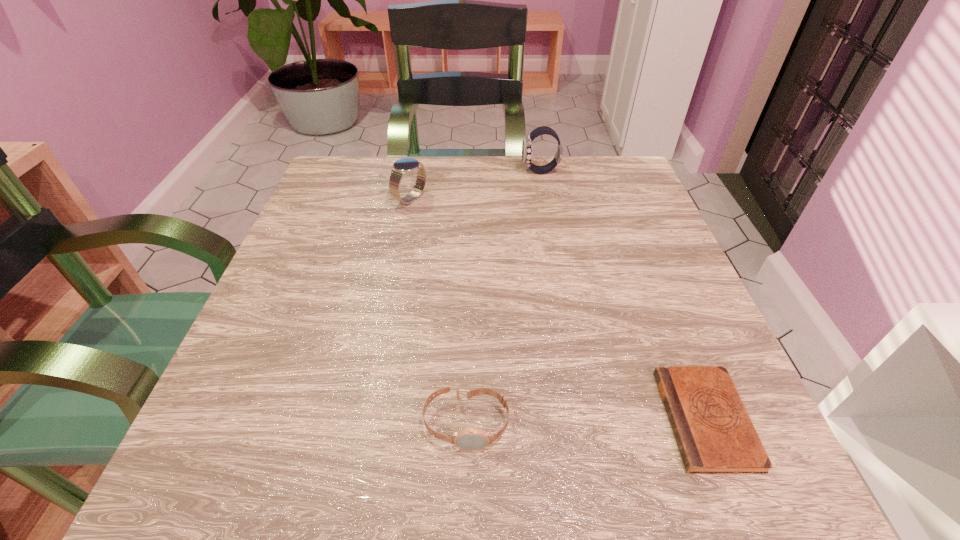
The width and height of the screenshot is (960, 540). What are the coordinates of `free space between the third object from left to right and the second farthest object` in the screenshot? It's located at (475, 185).

At what (x,y) coordinates should I click in order to perform the action: click on free area in between the second shortest object and the leftmost watch. Please return your answer as a coordinate pair (x, y). This screenshot has width=960, height=540. Looking at the image, I should click on click(439, 311).

At what (x,y) coordinates should I click in order to perform the action: click on free spot between the shortest watch and the diary. Please return your answer as a coordinate pair (x, y). This screenshot has height=540, width=960. Looking at the image, I should click on (586, 421).

Identify the location of vacant space in between the farthest object and the rightmost object. Image resolution: width=960 pixels, height=540 pixels. (623, 295).

Where is `vacant space that is in between the rightmost watch and the second object from left to right`? This screenshot has width=960, height=540. vacant space that is in between the rightmost watch and the second object from left to right is located at coordinates coord(503,298).

Select which object is the second closest to the shortest watch. Please provide its 2D coordinates. Your answer should be formatted as a tuple, i.e. [(x, y)], where the tuple contains the x and y coordinates of a point satisfying the conditions above.

[(403, 167)]

Select which object appears as the closest to the diary. Please provide its 2D coordinates. Your answer should be formatted as a tuple, i.e. [(x, y)], where the tuple contains the x and y coordinates of a point satisfying the conditions above.

[(471, 438)]

Point out which watch is positioned as the second nearest to the diary. Please provide its 2D coordinates. Your answer should be formatted as a tuple, i.e. [(x, y)], where the tuple contains the x and y coordinates of a point satisfying the conditions above.

[(527, 148)]

At what (x,y) coordinates should I click in order to perform the action: click on watch that is the third closest one to the diary. Please return your answer as a coordinate pair (x, y). Image resolution: width=960 pixels, height=540 pixels. Looking at the image, I should click on (403, 167).

The width and height of the screenshot is (960, 540). In order to click on blank area in the image that satisfies the following two spatial constraints: 1. on the face of the tallest watch; 2. on the face of the second watch from left to right in this screenshot , I will do `click(588, 423)`.